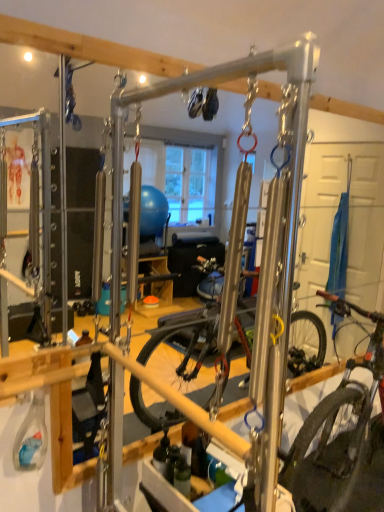
The width and height of the screenshot is (384, 512). Find the location of `shiny metallic bicycle at lower right`. shiny metallic bicycle at lower right is located at coordinates (342, 436).

Image resolution: width=384 pixels, height=512 pixels. What do you see at coordinates (342, 436) in the screenshot? I see `shiny metallic bicycle at lower right` at bounding box center [342, 436].

What is the approximate height of shiny metallic bicycle at lower right?

The height of shiny metallic bicycle at lower right is 1.15 meters.

Image resolution: width=384 pixels, height=512 pixels. I want to click on shiny metallic bicycle at lower right, so click(342, 436).